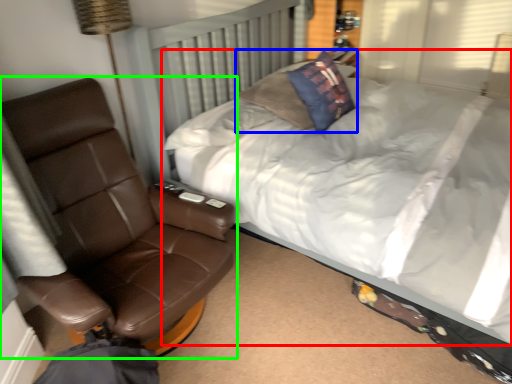
Question: Which object is the closest to the bed (highlighted by a red box)? Choose among these: pillow (highlighted by a blue box) or chair (highlighted by a green box).

Choices:
 (A) pillow
 (B) chair

Answer: (A)